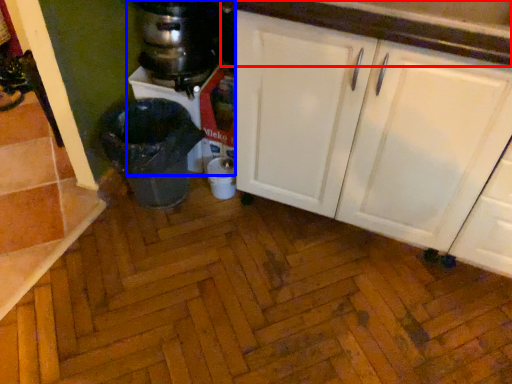
Question: Which object appears closest to the camera in this image, countertop (highlighted by a red box) or blender (highlighted by a blue box)?

Choices:
 (A) countertop
 (B) blender

Answer: (A)